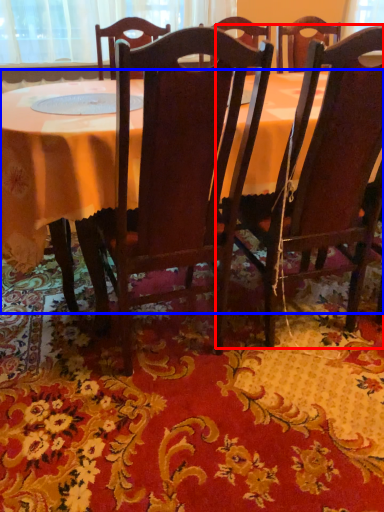
Question: Which object appears closest to the camera in this image, chair (highlighted by a red box) or table (highlighted by a blue box)?

Choices:
 (A) chair
 (B) table

Answer: (A)